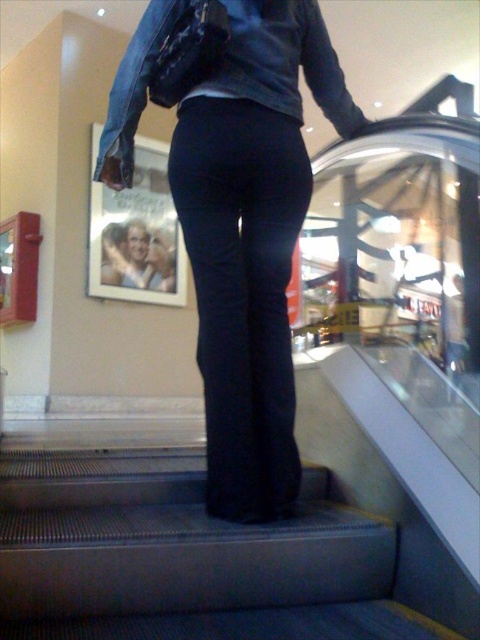
You are standing on an escalator in a mall and see a person wearing dark blue jeans at center and a denim jacket at upper center. Which piece of clothing is positioned to the right of the other?

The dark blue jeans at center are to the right of the denim jacket at upper center.

You are a fashion designer observing a person wearing dark blue jeans at center and a denim jacket at upper center. Which piece of clothing is longer in height?

The dark blue jeans at center is taller than denim jacket at upper center.

Based on the photo, you are a delivery person who needs to place a small package between the black fabric stairs at center and the denim jacket at upper center. Can you fit the package there if it measures 12 inches in length?

The distance between the black fabric stairs at center and the denim jacket at upper center is 36.91 inches. Since the package is only 12 inches long, there is enough space to fit it between them.